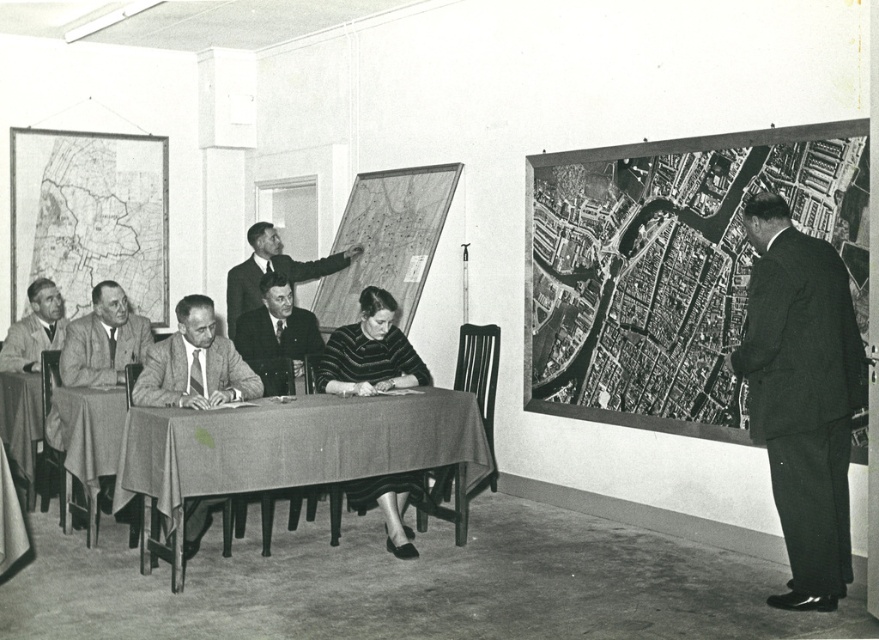
Question: Estimate the real-world distances between objects in this image. Which object is closer to the smooth suit jacket at center?

Choices:
 (A) striped sweater at center
 (B) light gray suit at table left

Answer: (B)

Question: Which object is closer to the camera taking this photo?

Choices:
 (A) light gray suit at left
 (B) light gray suit at table left

Answer: (B)

Question: Which of the following is the farthest from the observer?

Choices:
 (A) smooth black suit at center
 (B) smooth gray suit at left

Answer: (B)

Question: Does textured fabric table at center appear on the left side of striped sweater at center?

Choices:
 (A) yes
 (B) no

Answer: (A)

Question: Is dark gray suit at right below light gray suit at left?

Choices:
 (A) yes
 (B) no

Answer: (A)

Question: Does dark gray suit at right have a greater width compared to smooth black suit at center?

Choices:
 (A) no
 (B) yes

Answer: (B)